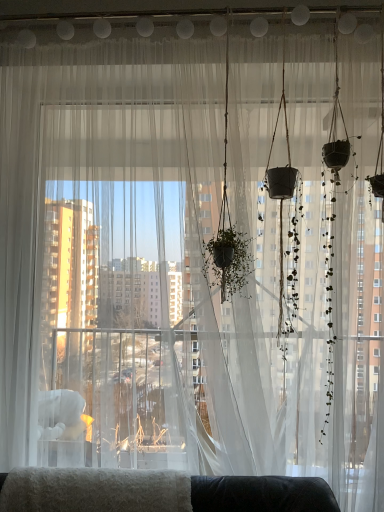
Where is `white fluffy blanket at lower center`? white fluffy blanket at lower center is located at coordinates (159, 492).

What do you see at coordinates (159, 492) in the screenshot?
I see `white fluffy blanket at lower center` at bounding box center [159, 492].

Locate an element on the screen. The width and height of the screenshot is (384, 512). white fluffy blanket at lower center is located at coordinates (159, 492).